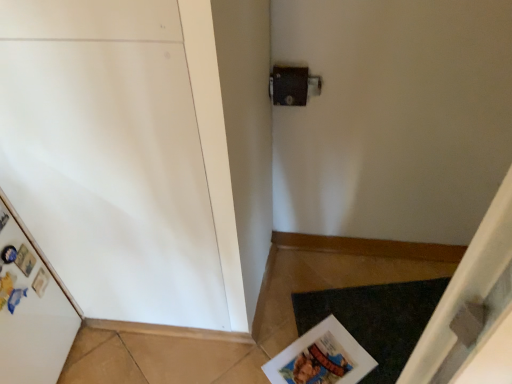
This screenshot has height=384, width=512. What do you see at coordinates (376, 319) in the screenshot?
I see `dark gray carpet at lower right` at bounding box center [376, 319].

Find the location of a particular element. Image resolution: width=512 pixels, height=384 pixels. dark gray carpet at lower right is located at coordinates (376, 319).

The image size is (512, 384). Describe the element at coordinates (321, 358) in the screenshot. I see `matte paper magazine at lower right` at that location.

Measure the distance between matte paper magazine at lower right and camera.

matte paper magazine at lower right is 4.21 feet from camera.

Locate an element on the screen. The image size is (512, 384). matte paper magazine at lower right is located at coordinates (321, 358).

Find the location of `dark gray carpet at lower right`. dark gray carpet at lower right is located at coordinates (376, 319).

Visually, is matte paper magazine at lower right positioned to the left or to the right of dark gray carpet at lower right?

In the image, matte paper magazine at lower right appears on the left side of dark gray carpet at lower right.

Between matte paper magazine at lower right and dark gray carpet at lower right, which one is positioned in front?

matte paper magazine at lower right is more forward.

Does point (360, 358) come farther from viewer compared to point (388, 356)?

No, (360, 358) is closer to viewer.

From the image's perspective, is matte paper magazine at lower right above dark gray carpet at lower right?

Actually, matte paper magazine at lower right appears below dark gray carpet at lower right in the image.

From a real-world perspective, is matte paper magazine at lower right located beneath dark gray carpet at lower right?

No, from a real-world perspective, matte paper magazine at lower right is not beneath dark gray carpet at lower right.

Looking at this image, in terms of width, does matte paper magazine at lower right look wider or thinner when compared to dark gray carpet at lower right?

Clearly, matte paper magazine at lower right has less width compared to dark gray carpet at lower right.

Is matte paper magazine at lower right shorter than dark gray carpet at lower right?

No, matte paper magazine at lower right is not shorter than dark gray carpet at lower right.

Can you confirm if matte paper magazine at lower right is smaller than dark gray carpet at lower right?

Yes, matte paper magazine at lower right is smaller than dark gray carpet at lower right.

Would you say matte paper magazine at lower right is inside or outside dark gray carpet at lower right?

matte paper magazine at lower right fits inside dark gray carpet at lower right.

Is matte paper magazine at lower right not near dark gray carpet at lower right?

No, there isn't a large distance between matte paper magazine at lower right and dark gray carpet at lower right.

Is matte paper magazine at lower right facing away from dark gray carpet at lower right?

Yes, matte paper magazine at lower right is facing away from dark gray carpet at lower right.

This screenshot has width=512, height=384. In order to click on magazine located below the dark gray carpet at lower right (from the image's perspective) in this screenshot , I will do `click(321, 358)`.

Based on the photo, does dark gray carpet at lower right appear on the left side of matte paper magazine at lower right?

Incorrect, dark gray carpet at lower right is not on the left side of matte paper magazine at lower right.

Is dark gray carpet at lower right in front of or behind matte paper magazine at lower right in the image?

Clearly, dark gray carpet at lower right is behind matte paper magazine at lower right.

Does point (382, 286) appear closer or farther from the camera than point (368, 356)?

Point (382, 286) is positioned farther from the camera compared to point (368, 356).

From the image's perspective, between dark gray carpet at lower right and matte paper magazine at lower right, which one is located above?

dark gray carpet at lower right is shown above in the image.

From a real-world perspective, who is located higher, dark gray carpet at lower right or matte paper magazine at lower right?

matte paper magazine at lower right.

In terms of width, does dark gray carpet at lower right look wider or thinner when compared to matte paper magazine at lower right?

Considering their sizes, dark gray carpet at lower right looks broader than matte paper magazine at lower right.

Can you confirm if dark gray carpet at lower right is shorter than matte paper magazine at lower right?

Yes, dark gray carpet at lower right is shorter than matte paper magazine at lower right.

Which of these two, dark gray carpet at lower right or matte paper magazine at lower right, is smaller?

matte paper magazine at lower right is smaller.

Is dark gray carpet at lower right not within matte paper magazine at lower right?

dark gray carpet at lower right lies outside matte paper magazine at lower right's area.

Are dark gray carpet at lower right and matte paper magazine at lower right making contact?

dark gray carpet at lower right and matte paper magazine at lower right are not in contact.

Is dark gray carpet at lower right positioned with its back to matte paper magazine at lower right?

No, dark gray carpet at lower right is not facing away from matte paper magazine at lower right.

What's the angular difference between dark gray carpet at lower right and matte paper magazine at lower right's facing directions?

The facing directions of dark gray carpet at lower right and matte paper magazine at lower right are 31.4 degrees apart.

How distant is dark gray carpet at lower right from matte paper magazine at lower right?

The distance of dark gray carpet at lower right from matte paper magazine at lower right is 4.33 inches.

The height and width of the screenshot is (384, 512). I want to click on magazine positioned vertically above the dark gray carpet at lower right (from a real-world perspective), so click(x=321, y=358).

You are a GUI agent. You are given a task and a screenshot of the screen. Output one action in this format:
    pyautogui.click(x=<x>, y=<y>)
    Task: Click on the magazine lying in front of the dark gray carpet at lower right
    
    Given the screenshot: What is the action you would take?
    pyautogui.click(x=321, y=358)

Locate an element on the screen. The width and height of the screenshot is (512, 384). doormat below the matte paper magazine at lower right (from a real-world perspective) is located at coordinates (376, 319).